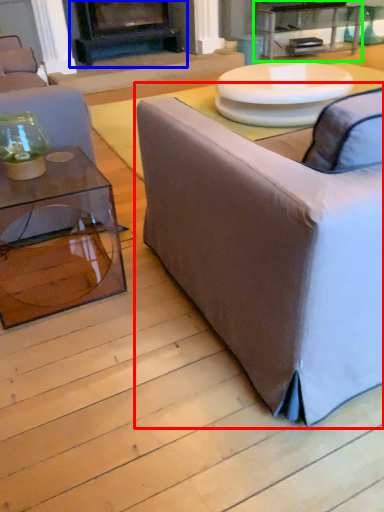
Question: Which object is positioned closest to studio couch (highlighted by a red box)? Select from fireplace (highlighted by a blue box) and table (highlighted by a green box).

Choices:
 (A) fireplace
 (B) table

Answer: (A)